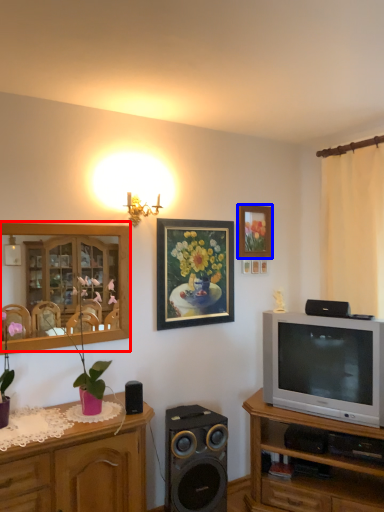
Question: Which of the following is the farthest to the observer, entertainment center (highlighted by a red box) or picture frame (highlighted by a blue box)?

Choices:
 (A) entertainment center
 (B) picture frame

Answer: (B)